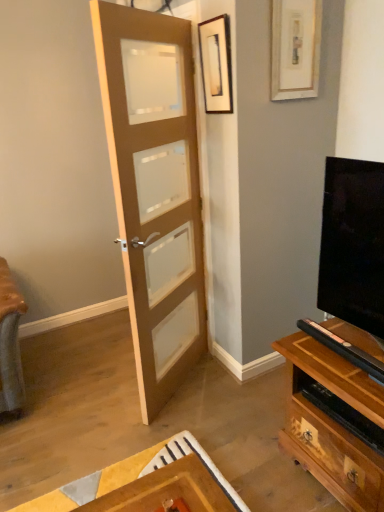
Question: In the image, is wooden framed picture at upper center, acting as the second picture frame starting from the right, positioned in front of or behind matte wood door at center?

Choices:
 (A) front
 (B) behind

Answer: (B)

Question: Is wooden framed picture at upper center, the first picture frame when ordered from left to right, wider or thinner than matte wood door at center?

Choices:
 (A) thin
 (B) wide

Answer: (A)

Question: Considering the real-world distances, which object is closest to the wooden framed picture at upper center, acting as the second picture frame starting from the right?

Choices:
 (A) white matte picture frame at upper right, which is the 1th picture frame in right-to-left order
 (B) black glossy tv at right
 (C) matte wood door at center

Answer: (A)

Question: Which object is positioned farthest from the white matte picture frame at upper right, the 2th picture frame positioned from the left?

Choices:
 (A) matte wood door at center
 (B) black glossy tv at right
 (C) wooden framed picture at upper center, acting as the second picture frame starting from the right

Answer: (B)